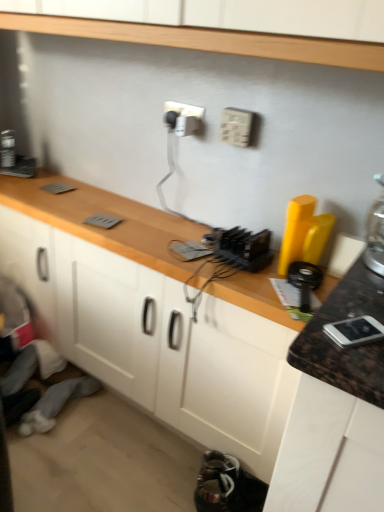
Question: Based on their sizes in the image, would you say white plastic electric outlet at upper center, the second electric outlet from the left, is bigger or smaller than matte gray cabinet at lower left?

Choices:
 (A) small
 (B) big

Answer: (A)

Question: Relative to matte gray cabinet at lower left, is white plastic electric outlet at upper center, which appears as the 2th electric outlet when viewed from the back, in front or behind?

Choices:
 (A) front
 (B) behind

Answer: (A)

Question: Considering the real-world distances, which object is farthest from the matte gray cabinet at lower left?

Choices:
 (A) multicolored fabric shoes at lower center
 (B) white plastic electric outlet at upper center, which appears as the 2th electric outlet when viewed from the back
 (C) white plastic electric outlet at upper center, the 1th electric outlet viewed from the back
 (D) wooden at center
 (E) silver metallic phone at right

Answer: (E)

Question: Which is farther from the matte gray cabinet at lower left?

Choices:
 (A) wooden at center
 (B) white plastic electric outlet at upper center, the 1th electric outlet viewed from the back
 (C) multicolored fabric shoes at lower center
 (D) white plastic electric outlet at upper center, the second electric outlet from the left
 (E) silver metallic phone at right

Answer: (E)